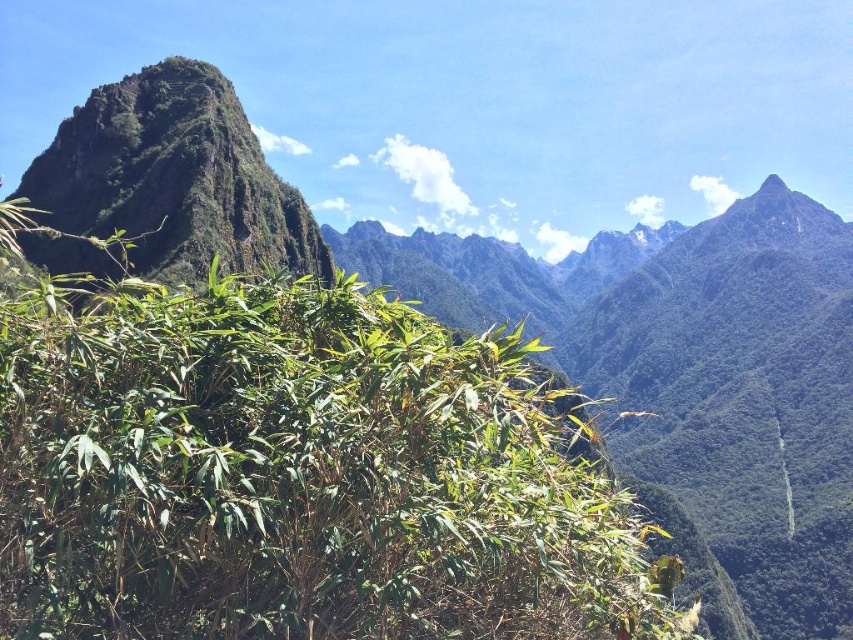
Which of these two, green leafy plant at center or green rough rock at upper left, stands shorter?

With less height is green leafy plant at center.

Is green leafy plant at center smaller than green rough rock at upper left?

No.

Which is in front, point (343, 470) or point (33, 243)?

Point (343, 470) is more forward.

The width and height of the screenshot is (853, 640). Find the location of `green leafy plant at center`. green leafy plant at center is located at coordinates (299, 474).